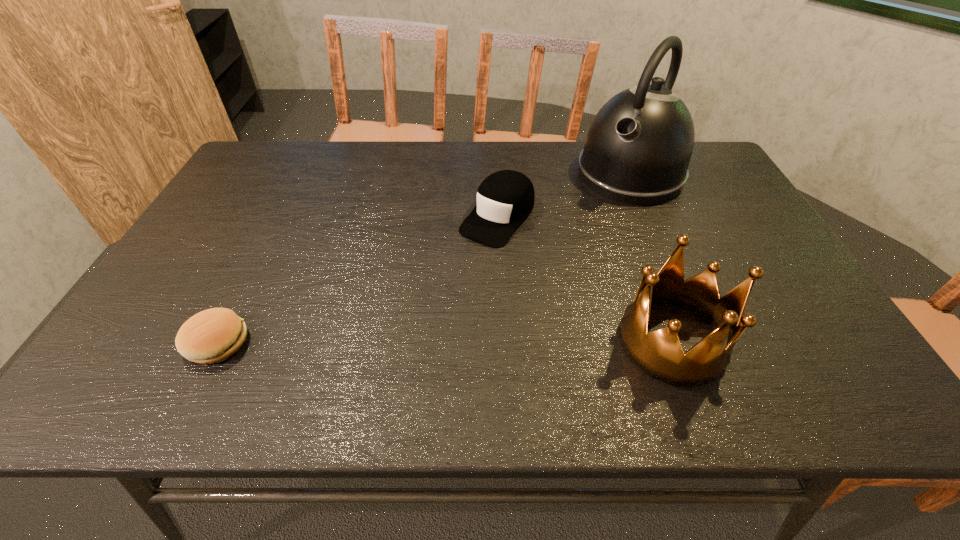
Identify the location of the leftmost object. (213, 335).

Where is `patty`? The height and width of the screenshot is (540, 960). patty is located at coordinates (213, 335).

In order to click on the second tallest object in this screenshot , I will do `click(659, 354)`.

Where is `cap`? This screenshot has height=540, width=960. cap is located at coordinates (505, 198).

The image size is (960, 540). Find the location of `the third object from right to left`. the third object from right to left is located at coordinates (505, 198).

Locate an element on the screen. This screenshot has height=540, width=960. the tallest object is located at coordinates [638, 148].

Locate an element on the screen. Image resolution: width=960 pixels, height=540 pixels. free space located on the back of the leftmost object is located at coordinates (272, 235).

The image size is (960, 540). What are the coordinates of `free space located 0.300m on the left of the crown` in the screenshot? It's located at (479, 341).

Identify the location of free point located 0.250m on the front-facing side of the third object from right to left. The width and height of the screenshot is (960, 540). (423, 307).

This screenshot has width=960, height=540. What are the coordinates of `vacant space positioned on the front-facing side of the third object from right to left` in the screenshot? It's located at (431, 298).